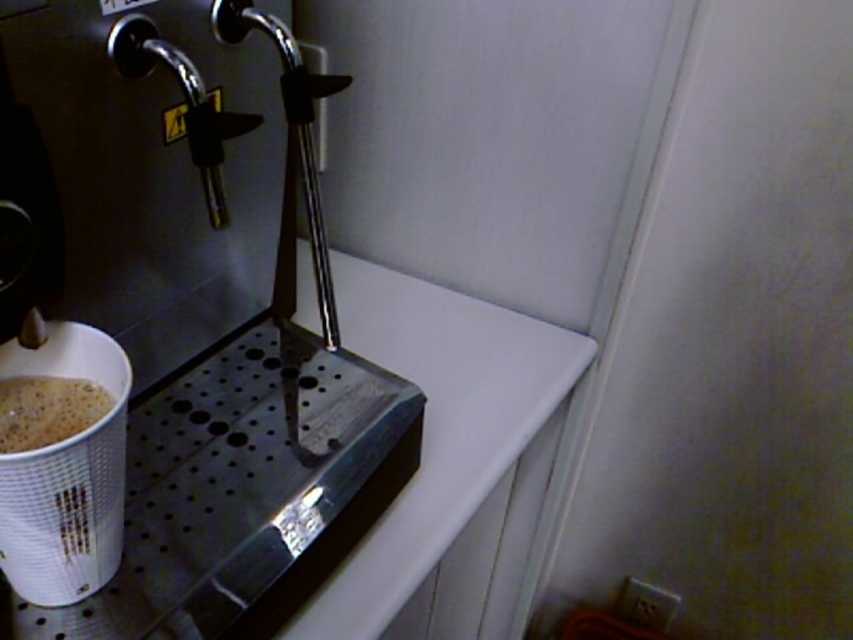
You are setting up a small coffee station and want to place the metallic silver coffee machine at left and the foamy white coffee at lower left next to each other. Which object should you place first to ensure they fit properly?

You should place the metallic silver coffee machine at left first because its width is greater than the foamy white coffee at lower left, so positioning it first ensures there is enough space for both objects.

You are at a coffee station and want to pour a drink from the metallic silver coffee machine at left into the white paper cup at lower left. Can you do this without moving either object?

The metallic silver coffee machine at left and white paper cup at lower left are 5.51 inches apart from each other. Since the distance between them is sufficient for pouring, you can pour the drink into the cup without moving either object.

You are holding a cup and want to pour a drink from the dispenser. The dispenser has two spouts located at point (x=3, y=560) and point (x=3, y=426). Which spout should you use if you want to pour the drink into the cup without spilling, considering their positions relative to you?

You should use the spout at point (x=3, y=560) because it is closer to you than the spout at point (x=3, y=426), making it easier to pour without spilling.